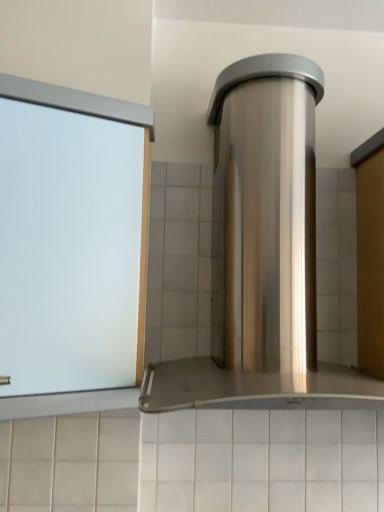
Question: In terms of width, does stainless steel range hood at center look wider or thinner when compared to frosted glass window at left?

Choices:
 (A) wide
 (B) thin

Answer: (A)

Question: From the image's perspective, is stainless steel range hood at center above or below frosted glass window at left?

Choices:
 (A) below
 (B) above

Answer: (B)

Question: Relative to frosted glass window at left, is stainless steel range hood at center in front or behind?

Choices:
 (A) front
 (B) behind

Answer: (A)

Question: Considering the positions of frosted glass window at left and stainless steel range hood at center in the image, is frosted glass window at left wider or thinner than stainless steel range hood at center?

Choices:
 (A) thin
 (B) wide

Answer: (A)

Question: Relative to stainless steel range hood at center, is frosted glass window at left in front or behind?

Choices:
 (A) front
 (B) behind

Answer: (B)

Question: From a real-world perspective, is frosted glass window at left above or below stainless steel range hood at center?

Choices:
 (A) above
 (B) below

Answer: (B)

Question: Is frosted glass window at left bigger or smaller than stainless steel range hood at center?

Choices:
 (A) big
 (B) small

Answer: (B)